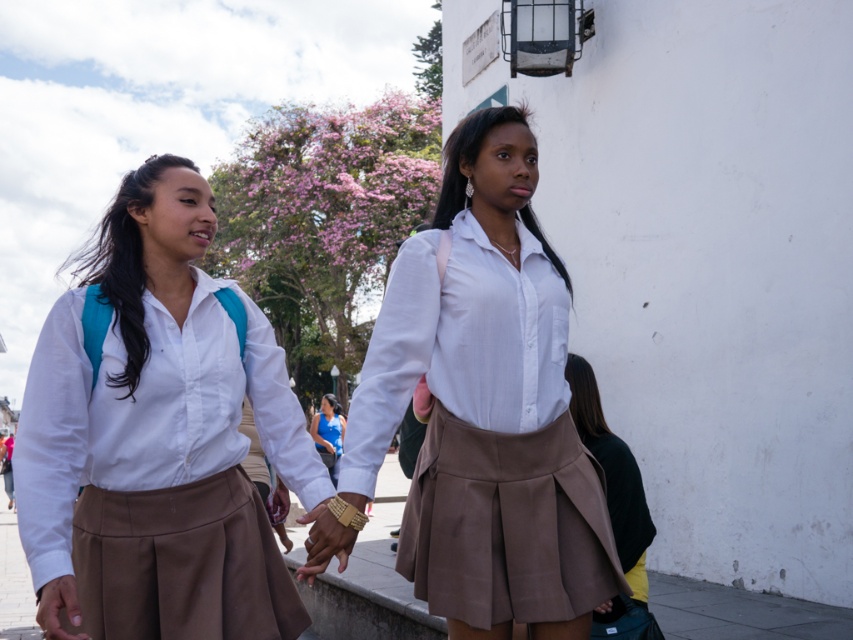
Is matte white shirt at center thinner than blue fabric shirt at center?

Correct, matte white shirt at center's width is less than blue fabric shirt at center's.

Between point (308, 621) and point (312, 433), which one is positioned in front?

Point (308, 621) is in front.

Is point (288, 460) positioned behind point (334, 452)?

That is False.

Locate an element on the screen. matte white shirt at center is located at coordinates (158, 440).

Where is `brown fabric pavement at lower center`? brown fabric pavement at lower center is located at coordinates (740, 612).

Find the location of a particular element. brown fabric pavement at lower center is located at coordinates (740, 612).

Which of these two, matte white shirt at center or matte white blouse at center, stands shorter?

matte white shirt at center

Does matte white shirt at center have a greater height compared to matte white blouse at center?

Incorrect, matte white shirt at center's height is not larger of matte white blouse at center's.

Is point (170, 541) closer to camera compared to point (453, 632)?

Yes, it is.

This screenshot has height=640, width=853. Identify the location of matte white shirt at center. (158, 440).